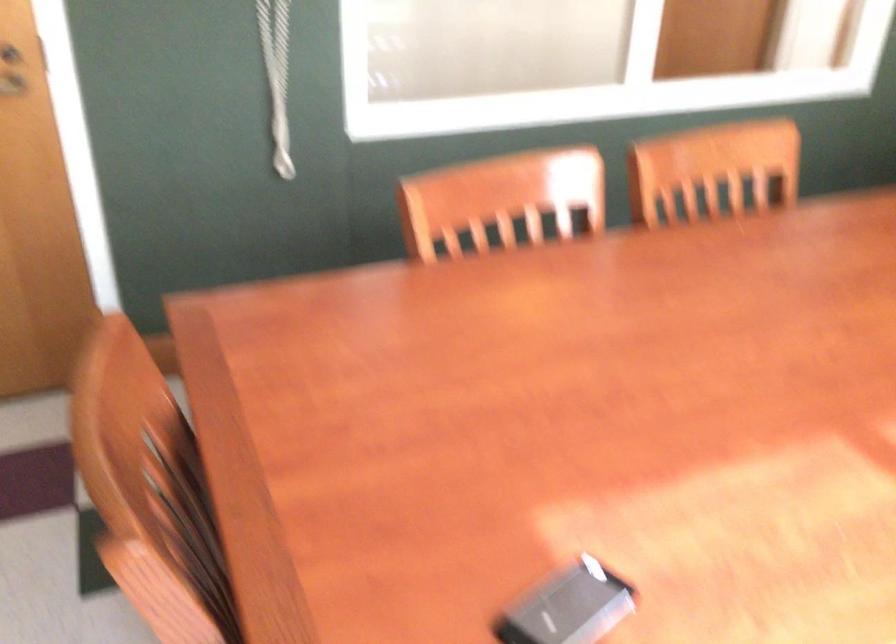
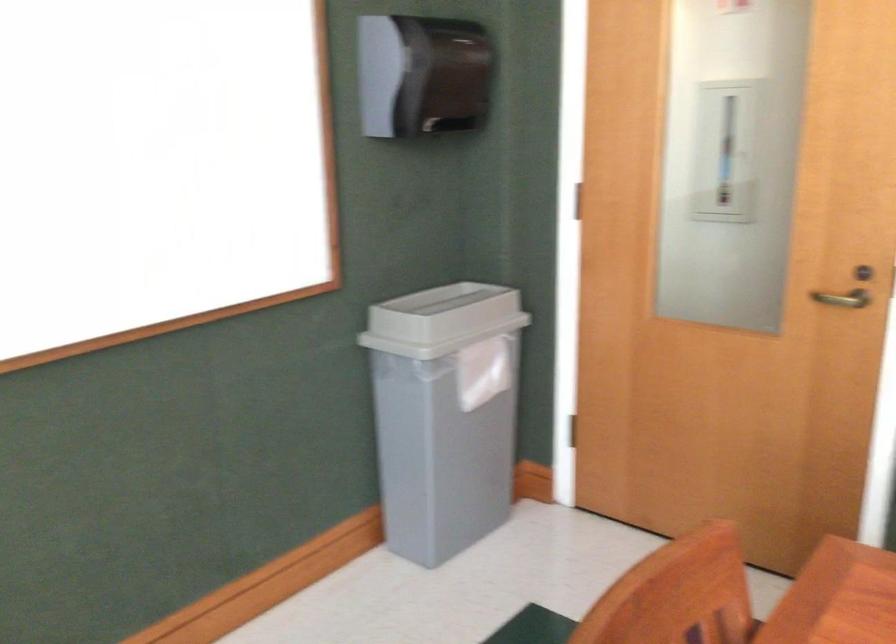
Question: How did the camera likely rotate?

Choices:
 (A) Left
 (B) Right
 (C) Up
 (D) Down

Answer: (A)